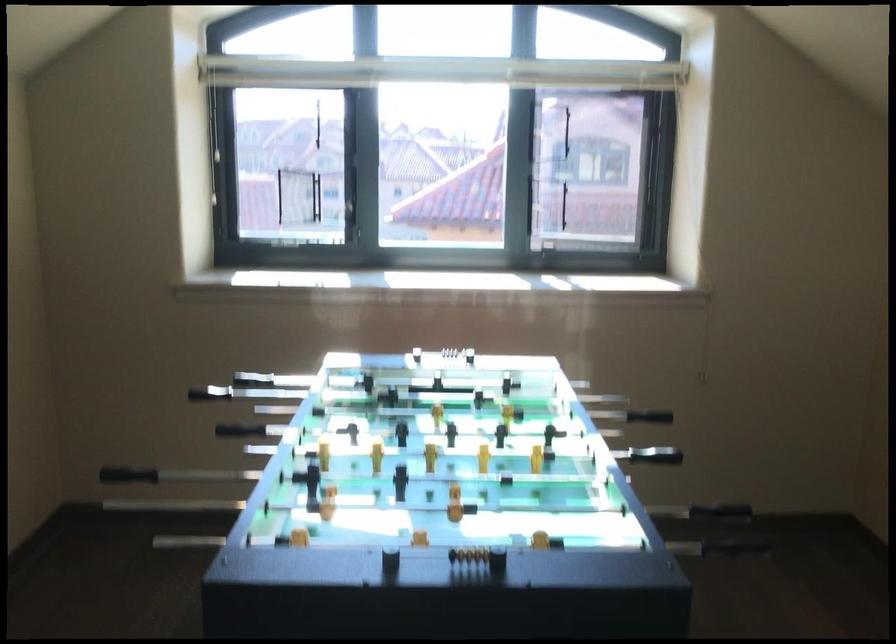
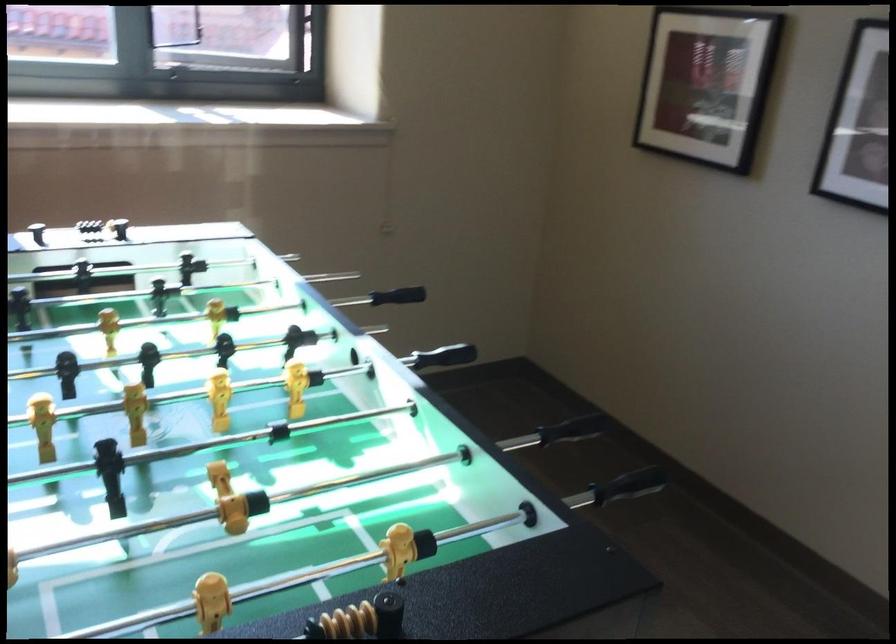
Question: The camera is either moving clockwise (left) or counter-clockwise (right) around the object. The first image is from the beginning of the video and the second image is from the end. Is the camera moving left or right when shooting the video?

Choices:
 (A) Left
 (B) Right

Answer: (A)